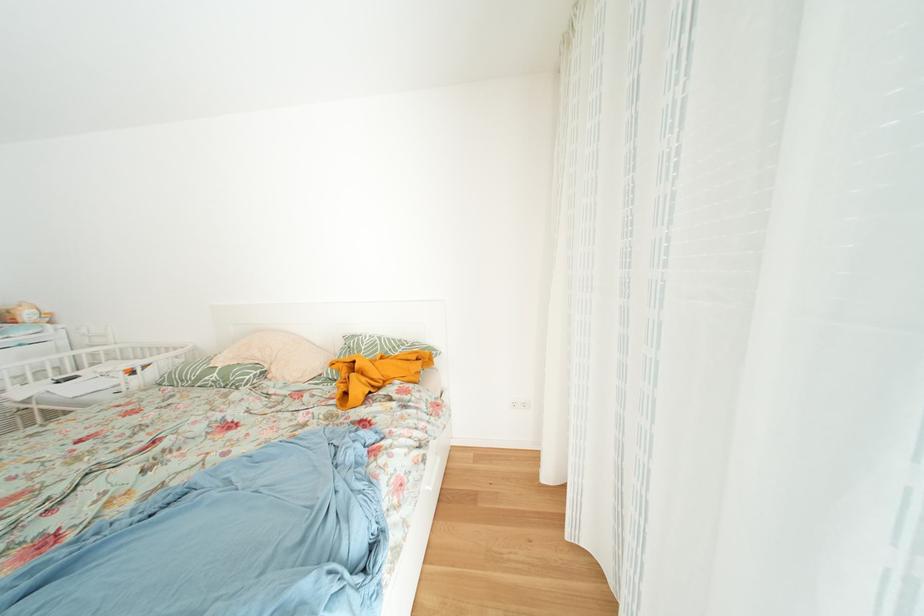
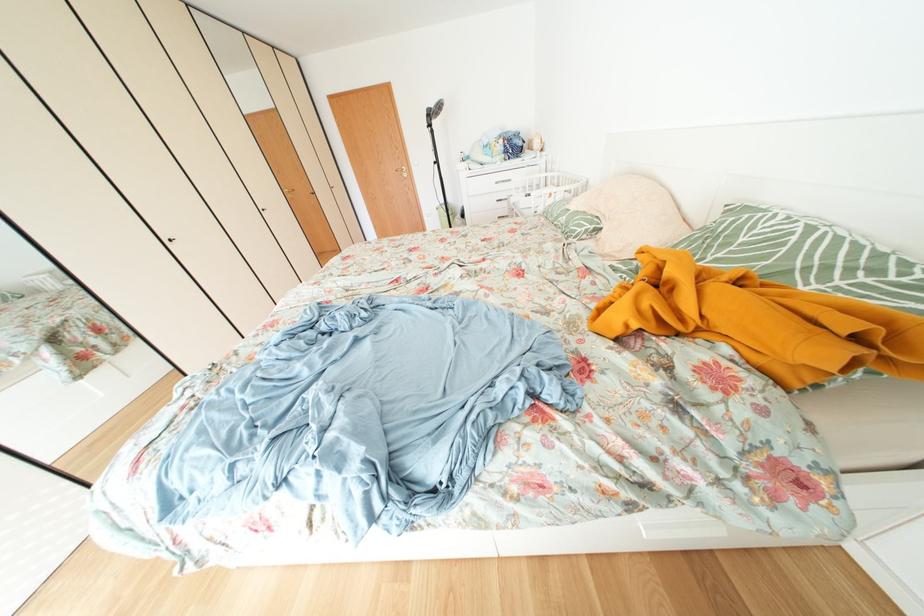
Find the pixel in the second image that matches point (404, 353) in the first image.

(837, 273)